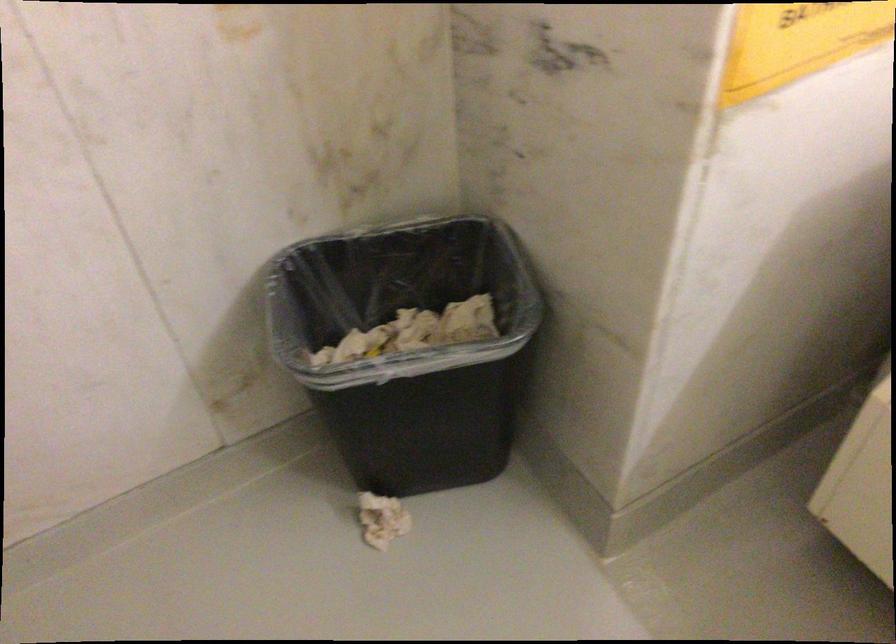
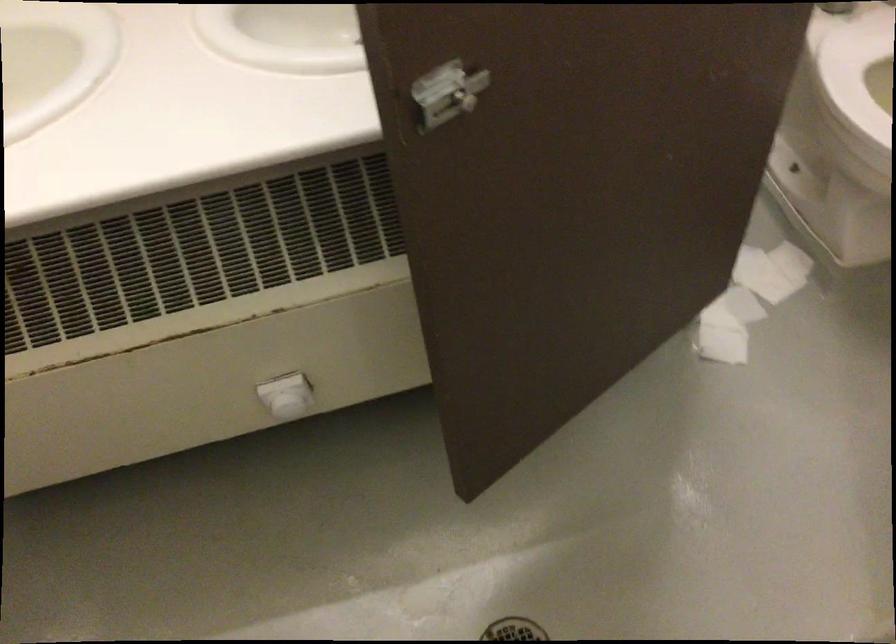
How did the camera likely rotate?

The camera rotated toward right-down.